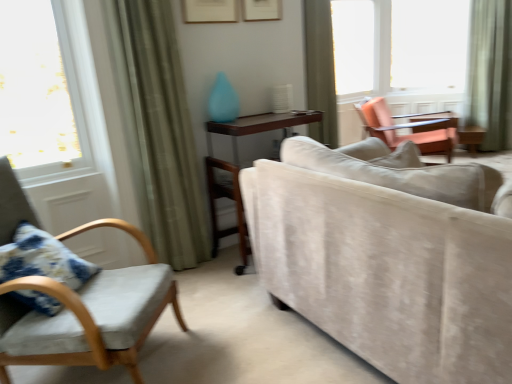
Question: Considering their positions, is green fabric curtain at left, the 1th curtain positioned from the left, located in front of or behind transparent glass window at upper right, marked as the first window in a right-to-left arrangement?

Choices:
 (A) behind
 (B) front

Answer: (B)

Question: Looking at their shapes, would you say green fabric curtain at left, acting as the third curtain starting from the back, is wider or thinner than transparent glass window at upper right, placed as the 2th window when sorted from left to right?

Choices:
 (A) wide
 (B) thin

Answer: (B)

Question: Estimate the real-world distances between objects in this image. Which object is farther from the green fabric curtain at right, which is the 1th curtain in right-to-left order?

Choices:
 (A) velvet cushioned chair at left, the 2th chair positioned from the back
 (B) wooden table at center
 (C) green fabric curtain at upper center, the second curtain in the left-to-right sequence
 (D) green fabric curtain at left, acting as the third curtain starting from the back
 (E) beige velvet couch at center

Answer: (A)

Question: Estimate the real-world distances between objects in this image. Which object is closer to the beige velvet couch at center?

Choices:
 (A) transparent glass window at upper right, which appears as the second window when viewed from the right
 (B) green fabric curtain at upper center, arranged as the second curtain when viewed from the right
 (C) velvet cushioned chair at left, the 2th chair positioned from the back
 (D) matte orange chair at upper right, the first chair from the right
 (E) blue floral fabric pillow at lower left

Answer: (C)